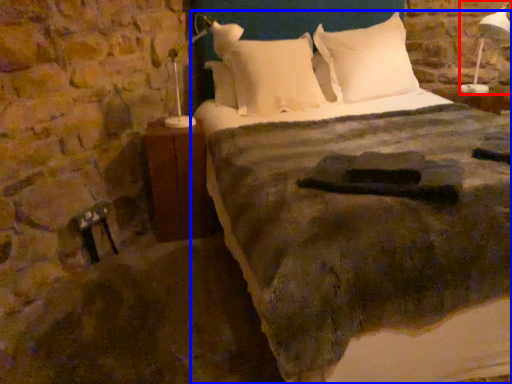
Question: Which point is further to the camera, bedside lamp (highlighted by a red box) or bed (highlighted by a blue box)?

Choices:
 (A) bedside lamp
 (B) bed

Answer: (A)